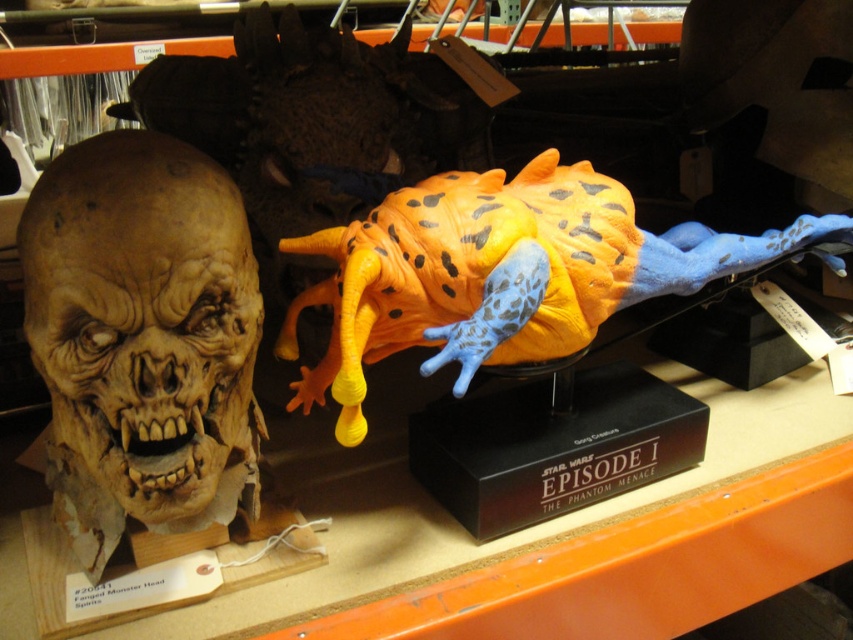
You are standing in front of the shelf with two sculptures. You notice two points marked on the shelf. The first point is at coordinates point [99,282] and the second point is at point [445,355]. Which point is closer to your current position?

Point [99,282] is closer to the camera than point [445,355], so the first point is closer to your current position.

You are organizing a shelf and want to place a new item between the matte plastic skull at left and the orange spotted rubber toy at center. Is there enough space between them to fit a 10 cm wide book?

The matte plastic skull at left is positioned on the left side of orange spotted rubber toy at center. Since the objects are placed side by side, there is space between them. However, the exact width isn